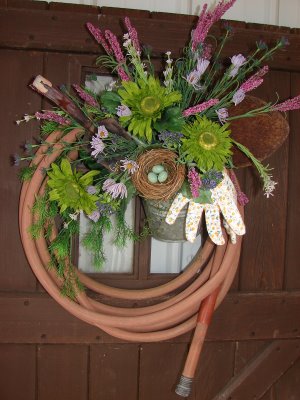
Locate an element on the screen. This screenshot has height=400, width=300. 1 right window is located at coordinates (165, 256).